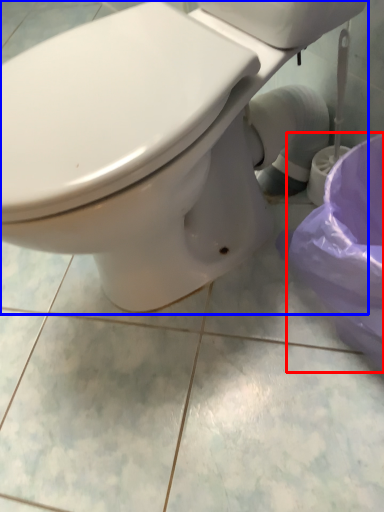
Question: Which point is closer to the camera, potty (highlighted by a red box) or toilet (highlighted by a blue box)?

Choices:
 (A) potty
 (B) toilet

Answer: (B)